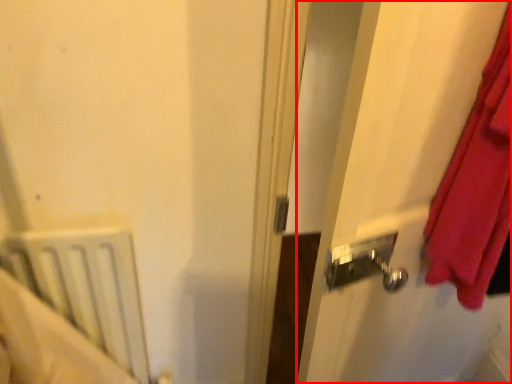
Question: From the image's perspective, considering the relative positions of screen door (annotated by the red box) and radiator in the image provided, where is screen door (annotated by the red box) located with respect to the staircase?

Choices:
 (A) below
 (B) above

Answer: (B)